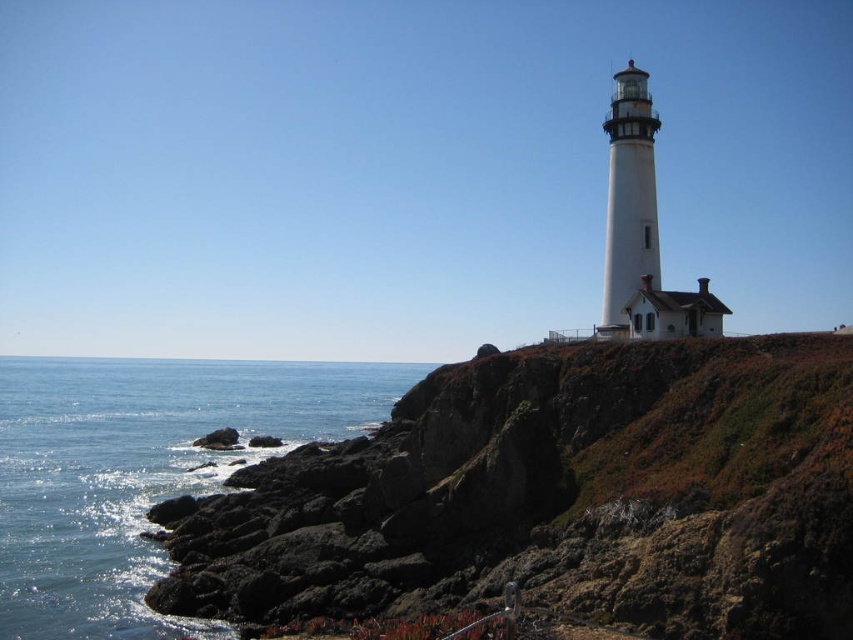
You are a photographer planning to capture the lighthouse and its surroundings. You want to ensure both the rough volcanic rock at center and the blue water at lower left are visible in your shot. Which object should you focus on to ensure both are included in the frame?

The rough volcanic rock at center occupies less space than blue water at lower left, so you should focus on the blue water at lower left to ensure both are included in the frame.

You are standing on the cliff near the lighthouse and want to place a 1.2 meter tall statue. The statue needs to be placed so that it is shorter than the rough volcanic rock at center and taller than the blue water at lower left. Is this possible?

The rough volcanic rock at center is taller than blue water at lower left. Since the statue is 1.2 meters tall, it can be placed as long as the rough volcanic rock at center is taller than 1.2 meters and the blue water at lower left is shorter than 1.2 meters. However, without specific measurements of the objects, we cannot confirm if the statue meets the required height constraints.

You are a hiker standing at the base of the cliff looking upward toward the lighthouse. You notice the rough volcanic rock at center and the blue water at lower left. Which object is closer to you from your current position?

The rough volcanic rock at center is closer to you because it is in front of the blue water at lower left.